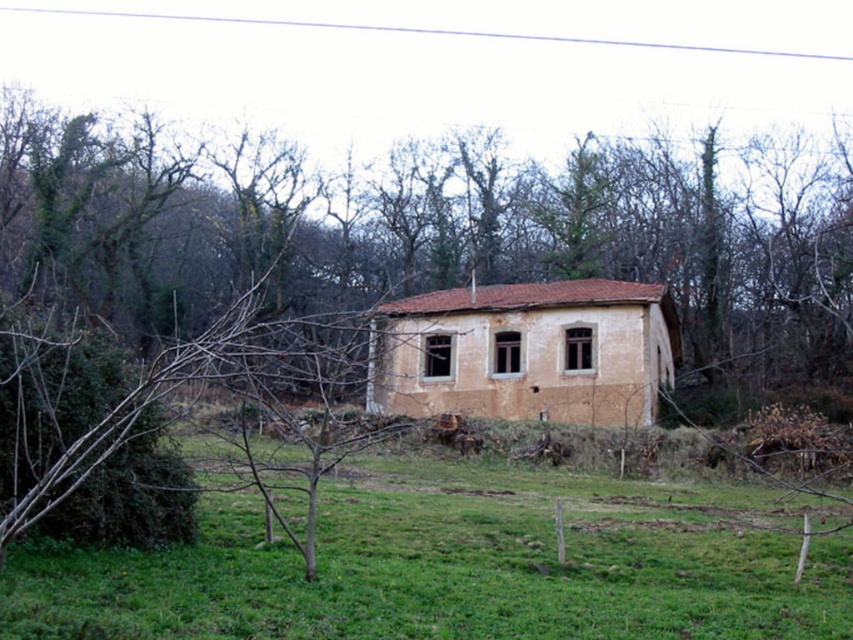
You are planning to plant a row of flowers along the edge of the green grass at center. Considering the space available, will the flowers fit if each flower requires 0.5 meters of width? Please refer to the brown textured house at center for context.

The green grass at center has a width less than the brown textured house at center. Since the house is the main structure, its width is likely sufficient to accommodate the flowers, but the grass area itself may not have enough space. However, without knowing the exact width of the house, it is impossible to determine if the flowers will fit. Please measure the actual dimensions before proceeding.

You are standing at a safe distance from the building and want to take a photo of the point at coordinate point (x=683, y=252). If your camera has a maximum zoom range of 200 feet, will you be able to capture the point clearly?

The distance between you and the point at point (x=683, y=252) is 185.10 feet, which is within your camera maximum zoom range of 200 feet. Therefore, you can capture the point clearly.